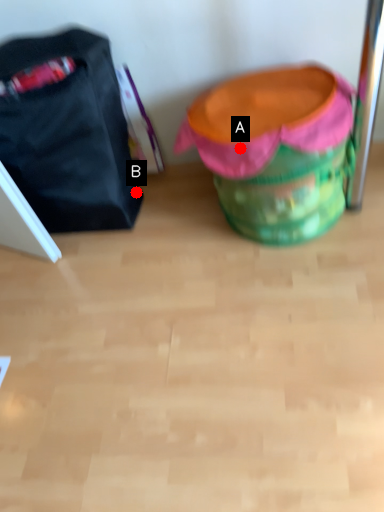
Question: Two points are circled on the image, labeled by A and B beside each circle. Which point appears closest to the camera in this image?

Choices:
 (A) A is closer
 (B) B is closer

Answer: (A)